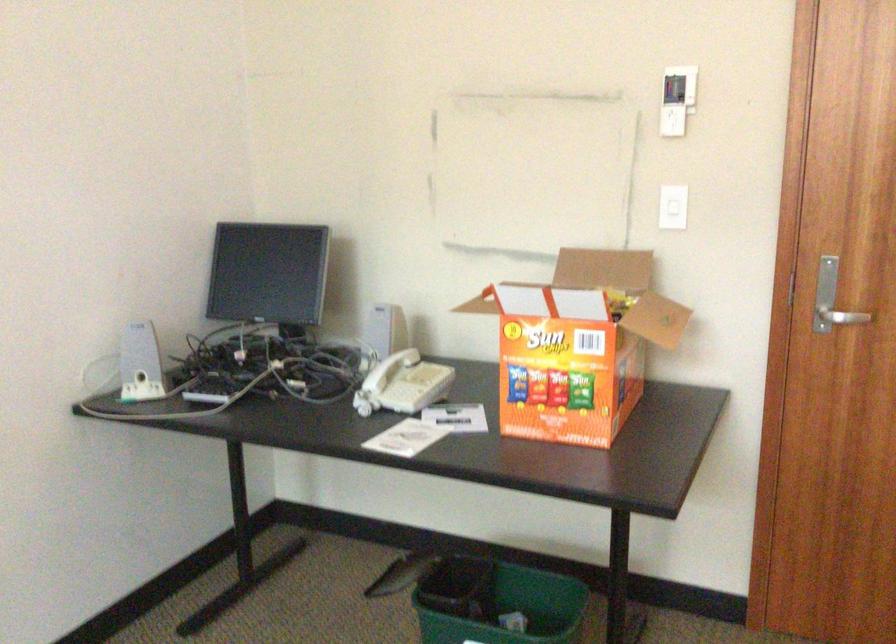
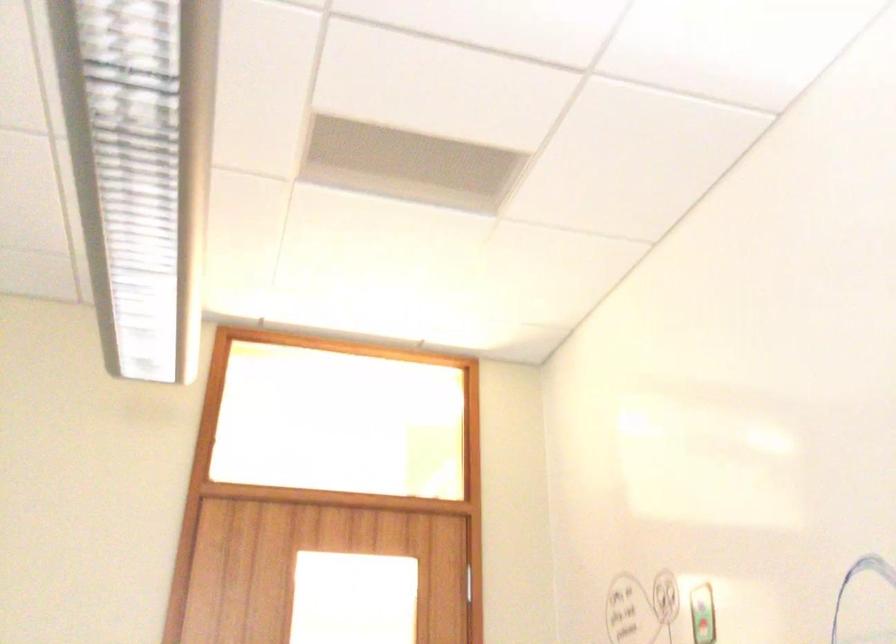
First-person continuous shooting, in which direction is the camera rotating?

The camera's rotation is toward right-up.